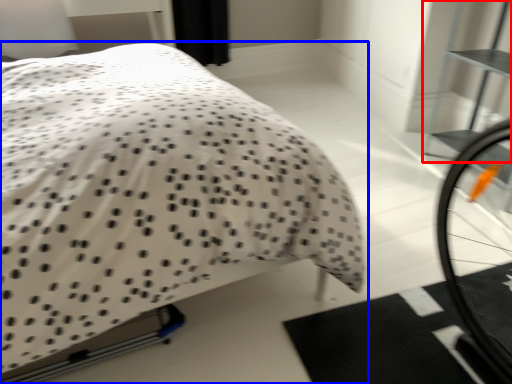
Question: Which point is further to the camera, bookshelf (highlighted by a red box) or bed (highlighted by a blue box)?

Choices:
 (A) bookshelf
 (B) bed

Answer: (A)